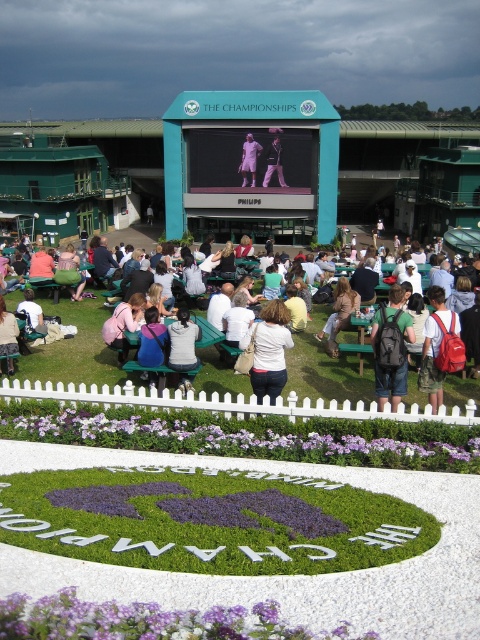
Who is shorter, purple leafy plant at lower center or red backpack at center?

purple leafy plant at lower center

What do you see at coordinates (249, 435) in the screenshot?
I see `purple leafy plant at lower center` at bounding box center [249, 435].

Is point (162, 419) closer to camera compared to point (433, 364)?

That is True.

Identify the location of purple leafy plant at lower center. The image size is (480, 640). (249, 435).

How distant is purple matte flower at lower center from red backpack at center?

purple matte flower at lower center and red backpack at center are 6.31 meters apart from each other.

Is point (200, 627) behind point (432, 332)?

No, (200, 627) is in front of (432, 332).

Who is more distant from viewer, [215,605] or [432,358]?

Point [432,358]

You are a GUI agent. You are given a task and a screenshot of the screen. Output one action in this format:
    pyautogui.click(x=<x>, y=<y>)
    Task: Click on the purple matte flower at lower center
    This screenshot has height=640, width=480.
    Given the screenshot: What is the action you would take?
    pyautogui.click(x=146, y=621)

Does purple leafy plant at lower center appear on the left side of matte black suit at center?

Correct, you'll find purple leafy plant at lower center to the left of matte black suit at center.

From the picture: Does purple leafy plant at lower center appear over matte black suit at center?

Actually, purple leafy plant at lower center is below matte black suit at center.

Describe the element at coordinates (249, 435) in the screenshot. The width and height of the screenshot is (480, 640). I see `purple leafy plant at lower center` at that location.

Locate an element on the screen. The height and width of the screenshot is (640, 480). purple leafy plant at lower center is located at coordinates (249, 435).